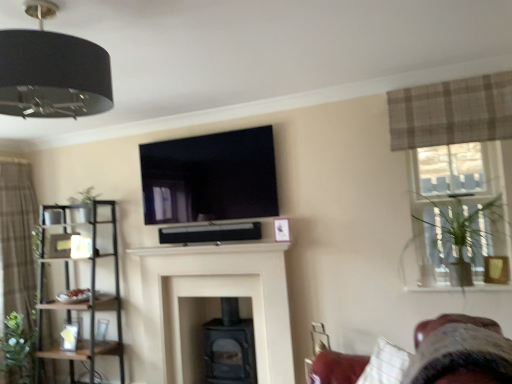
Find the location of a particular element. The width and height of the screenshot is (512, 384). empty space that is ontop of plaid fabric curtain at upper right, the 1th curtain positioned from the top (from a real-world perspective) is located at coordinates (446, 81).